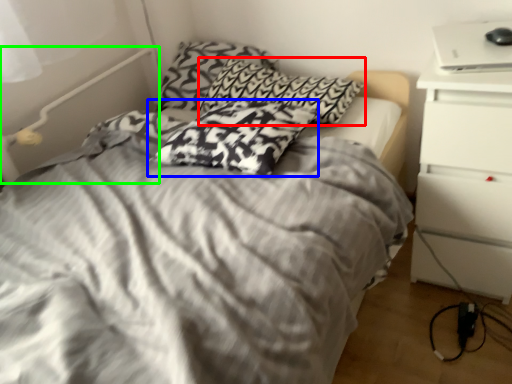
Question: Estimate the real-world distances between objects in this image. Which object is farther from pillow (highlighted by a red box), pillow (highlighted by a blue box) or bed frame (highlighted by a green box)?

Choices:
 (A) pillow
 (B) bed frame

Answer: (B)